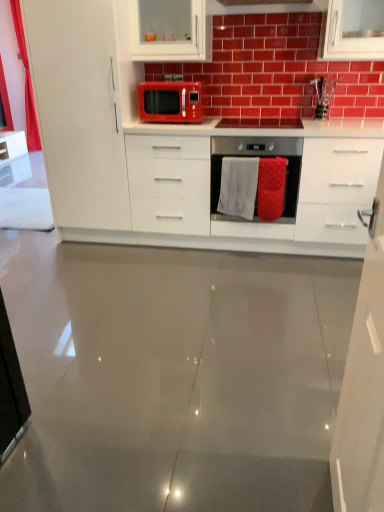
Question: Can you confirm if white glossy cabinet at upper right, placed as the 3th cabinetry when sorted from back to front, is bigger than red textured towel at center?

Choices:
 (A) no
 (B) yes

Answer: (B)

Question: From the image's perspective, is white glossy cabinet at upper right, which is the first cabinetry from front to back, below red textured towel at center?

Choices:
 (A) no
 (B) yes

Answer: (B)

Question: Does white glossy cabinet at upper right, placed as the 3th cabinetry when sorted from back to front, contain red textured towel at center?

Choices:
 (A) yes
 (B) no

Answer: (B)

Question: Does white glossy cabinet at upper right, placed as the 3th cabinetry when sorted from back to front, touch red textured towel at center?

Choices:
 (A) no
 (B) yes

Answer: (A)

Question: Considering the relative positions of white glossy cabinet at upper right, positioned as the third cabinetry in left-to-right order, and red textured towel at center in the image provided, is white glossy cabinet at upper right, positioned as the third cabinetry in left-to-right order, in front of red textured towel at center?

Choices:
 (A) no
 (B) yes

Answer: (B)

Question: From the image's perspective, is matte red microwave at center located above or below white glossy cabinet at upper center, which appears as the second cabinetry when viewed from the right?

Choices:
 (A) below
 (B) above

Answer: (A)

Question: Visually, is matte red microwave at center positioned to the left or to the right of white glossy cabinet at upper center, acting as the 2th cabinetry starting from the left?

Choices:
 (A) right
 (B) left

Answer: (B)

Question: Considering the positions of matte red microwave at center and white glossy cabinet at upper center, acting as the 3th cabinetry starting from the front, in the image, is matte red microwave at center taller or shorter than white glossy cabinet at upper center, acting as the 3th cabinetry starting from the front,?

Choices:
 (A) short
 (B) tall

Answer: (A)

Question: Is matte red microwave at center bigger or smaller than white glossy cabinet at upper center, which ranks as the 1th cabinetry in back-to-front order?

Choices:
 (A) small
 (B) big

Answer: (A)

Question: Relative to white glossy cabinet at upper center, which ranks as the 1th cabinetry in back-to-front order, is white glossy countertop at center in front or behind?

Choices:
 (A) front
 (B) behind

Answer: (A)

Question: Looking at the image, does white glossy countertop at center seem bigger or smaller compared to white glossy cabinet at upper center, acting as the 2th cabinetry starting from the left?

Choices:
 (A) small
 (B) big

Answer: (B)

Question: Based on their positions, is white glossy countertop at center located to the left or right of white glossy cabinet at upper center, acting as the 2th cabinetry starting from the left?

Choices:
 (A) left
 (B) right

Answer: (B)

Question: Is point (163, 143) closer or farther from the camera than point (182, 42)?

Choices:
 (A) farther
 (B) closer

Answer: (B)

Question: Visually, is white glossy cabinet at left, which is the third cabinetry in right-to-left order, positioned to the left or to the right of red textured towel at center?

Choices:
 (A) left
 (B) right

Answer: (A)

Question: Looking at their shapes, would you say white glossy cabinet at left, arranged as the second cabinetry when viewed from the front, is wider or thinner than red textured towel at center?

Choices:
 (A) wide
 (B) thin

Answer: (A)